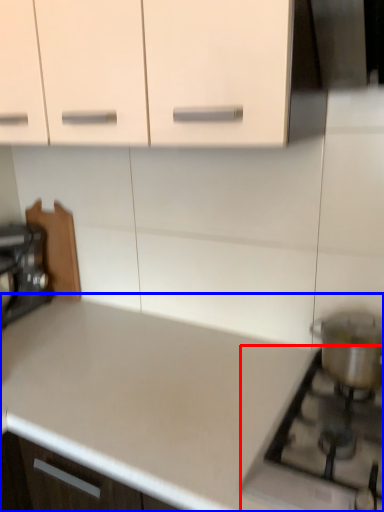
Question: Among these objects, which one is nearest to the camera, gas stove (highlighted by a red box) or countertop (highlighted by a blue box)?

Choices:
 (A) gas stove
 (B) countertop

Answer: (B)